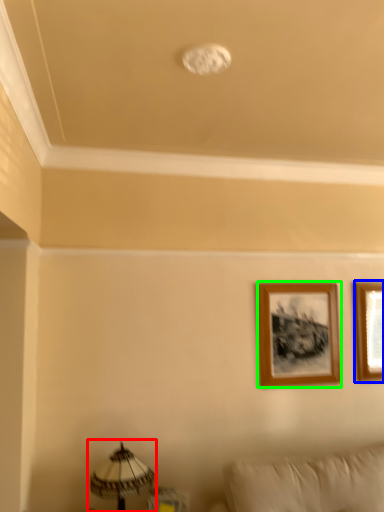
Question: Estimate the real-world distances between objects in this image. Which object is farther from table lamp (highlighted by a red box), picture frame (highlighted by a blue box) or picture frame (highlighted by a green box)?

Choices:
 (A) picture frame
 (B) picture frame

Answer: (A)